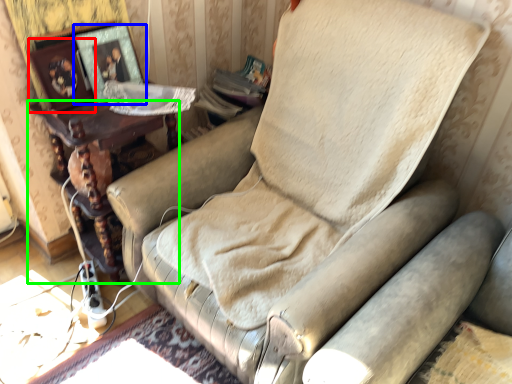
Question: Which is nearer to the picture frame (highlighted by a red box)? picture frame (highlighted by a blue box) or furniture (highlighted by a green box).

Choices:
 (A) picture frame
 (B) furniture

Answer: (A)